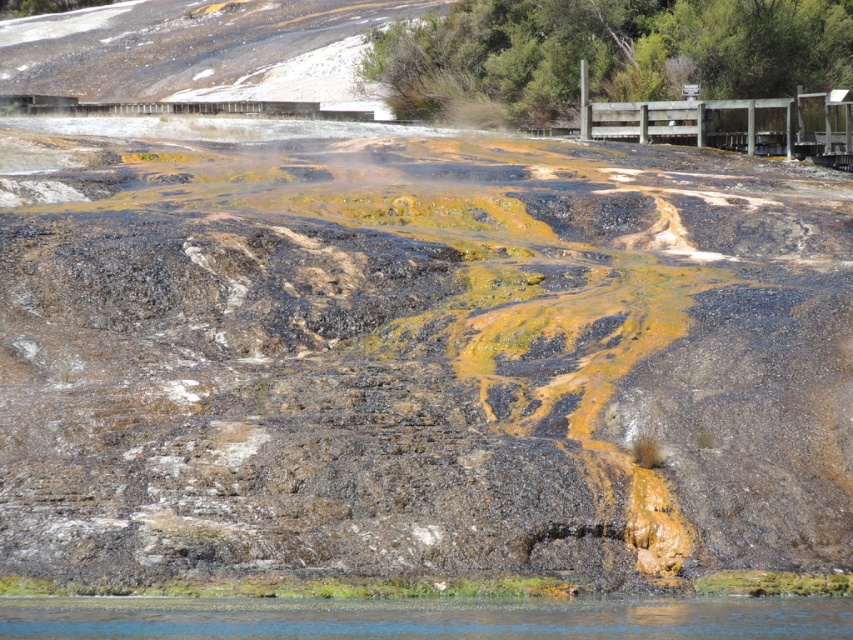
Does rusty metal bridge at upper left have a smaller size compared to clear water at lower center?

No, rusty metal bridge at upper left is not smaller than clear water at lower center.

The height and width of the screenshot is (640, 853). Identify the location of rusty metal bridge at upper left. (195, 49).

Where is `rusty metal bridge at upper left`? The height and width of the screenshot is (640, 853). rusty metal bridge at upper left is located at coordinates (195, 49).